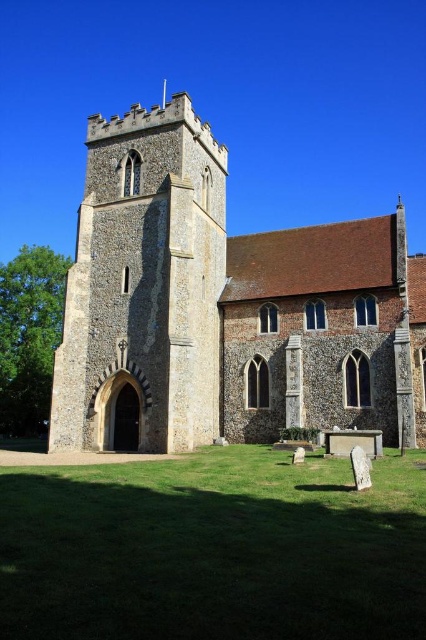
This screenshot has height=640, width=426. In order to click on stone tower at center in this screenshot , I will do `click(224, 307)`.

Which is in front, point (115, 381) or point (181, 307)?

Positioned in front is point (181, 307).

At what (x,y) coordinates should I click in order to perform the action: click on stone tower at center. Please return your answer as a coordinate pair (x, y). This screenshot has height=640, width=426. Looking at the image, I should click on (224, 307).

Identify the location of stone tower at center. This screenshot has width=426, height=640. (224, 307).